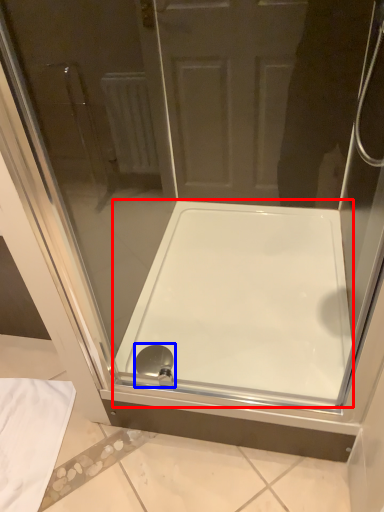
Question: Which point is further to the camera, bathtub (highlighted by a red box) or shower (highlighted by a blue box)?

Choices:
 (A) bathtub
 (B) shower

Answer: (B)